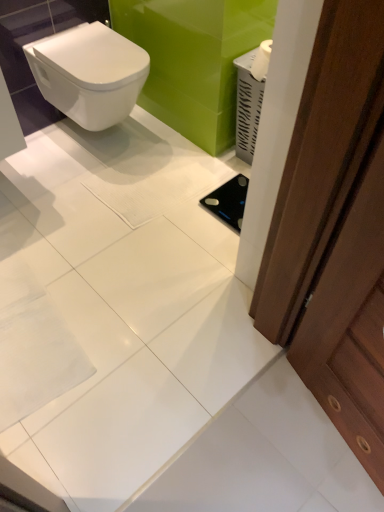
Find the location of a particular element. The image size is (384, 512). vacant space situated above white glossy toilet at upper left (from a real-world perspective) is located at coordinates (93, 48).